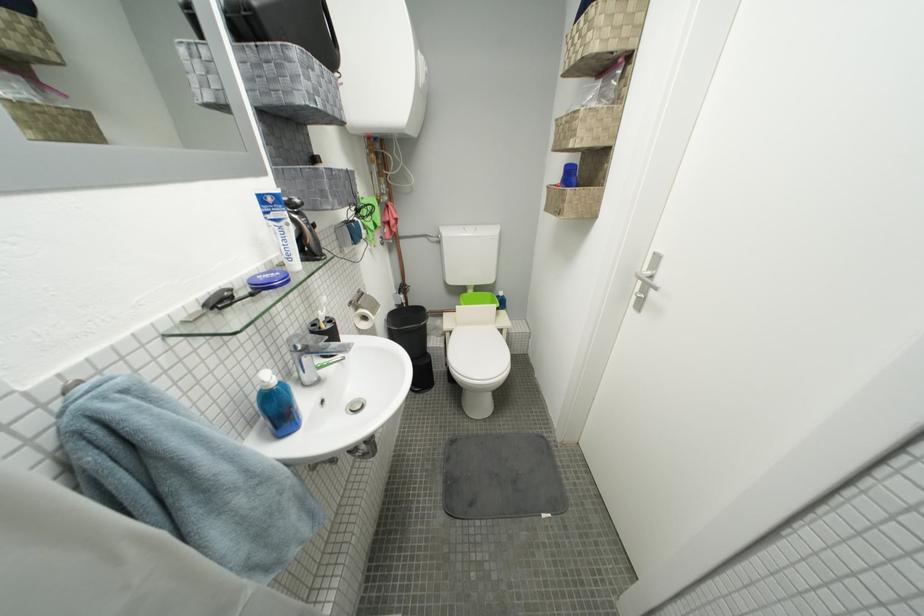
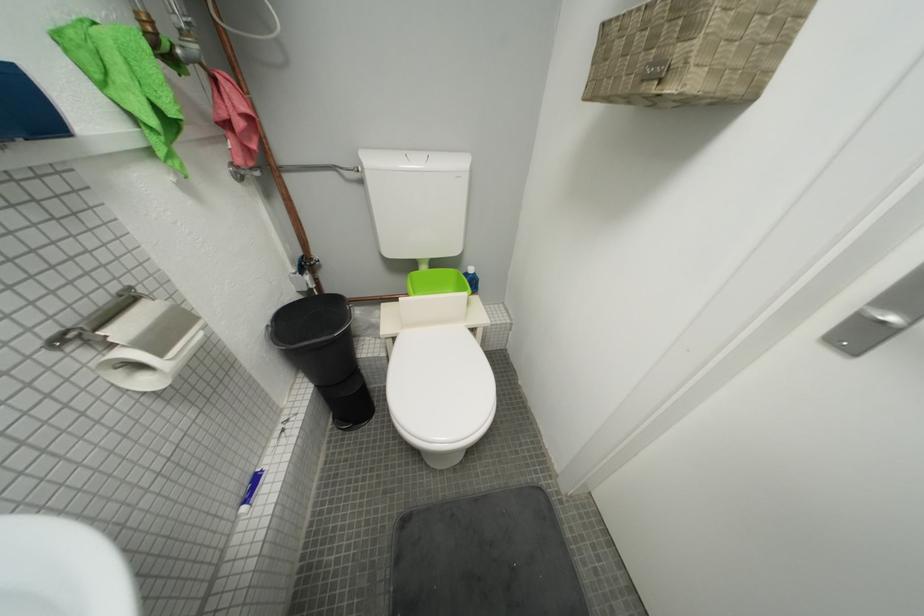
Question: In a continuous first-person perspective shot, in which direction is the camera moving?

Choices:
 (A) Left
 (B) Right
 (C) Forward
 (D) Backward

Answer: (C)